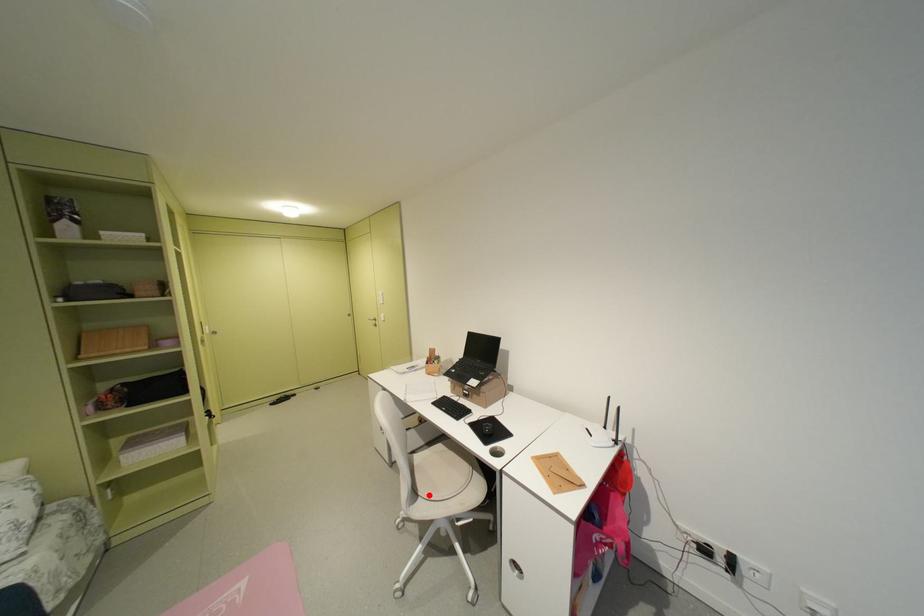
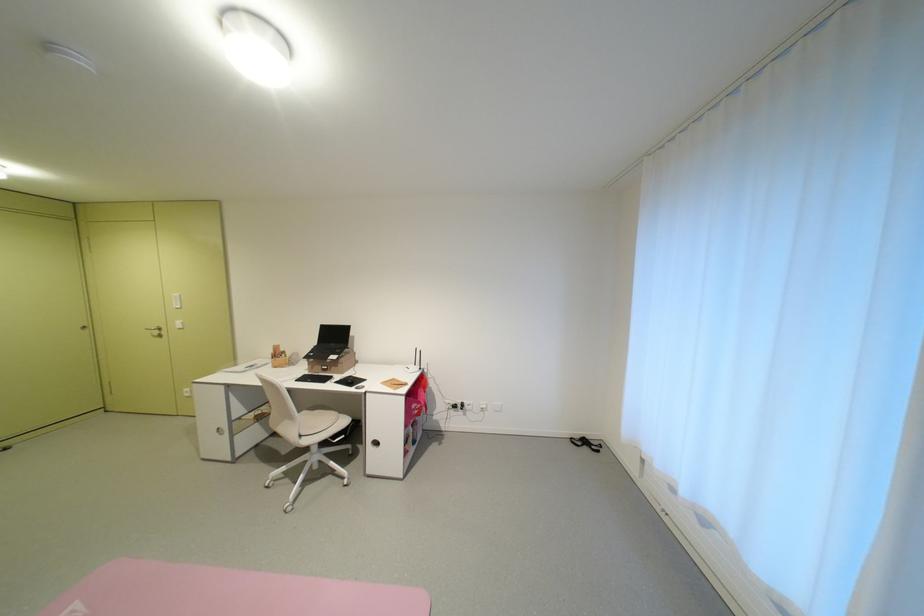
Question: I am providing you with two images of the same scene from different viewpoints. A red point is shown in image1. For the corresponding object point in image2, is it positioned nearer or farther from the camera?

Choices:
 (A) Nearer
 (B) Farther

Answer: (B)